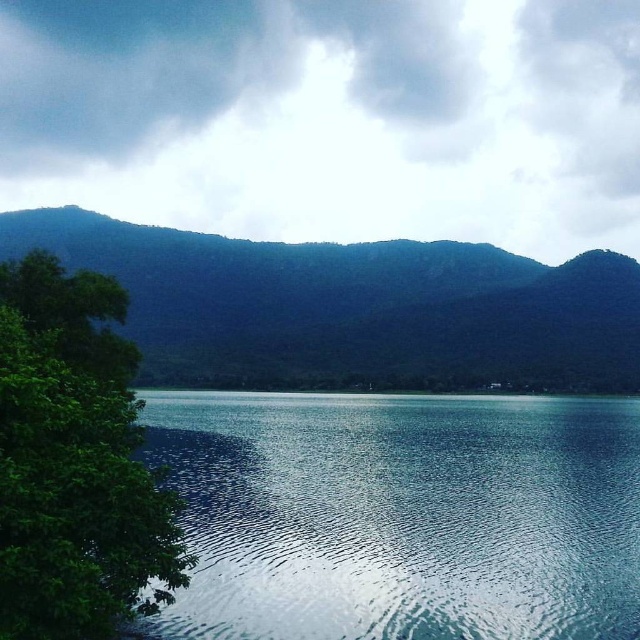
Question: Is white fluffy cloud at upper center to the left of green forested mountain at center from the viewer's perspective?

Choices:
 (A) yes
 (B) no

Answer: (B)

Question: Considering the real-world distances, which object is closest to the white fluffy cloud at upper center?

Choices:
 (A) clear water at center
 (B) green forested mountain at center

Answer: (B)

Question: Which point appears closest to the camera in this image?

Choices:
 (A) (90, 497)
 (B) (595, 536)

Answer: (A)

Question: Which point is closer to the camera?

Choices:
 (A) clear water at center
 (B) green forested mountain at center
 (C) white fluffy cloud at upper center
 (D) green leafy tree at left

Answer: (D)

Question: Is white fluffy cloud at upper center thinner than green leafy tree at left?

Choices:
 (A) no
 (B) yes

Answer: (A)

Question: Does white fluffy cloud at upper center have a larger size compared to green leafy tree at left?

Choices:
 (A) no
 (B) yes

Answer: (B)